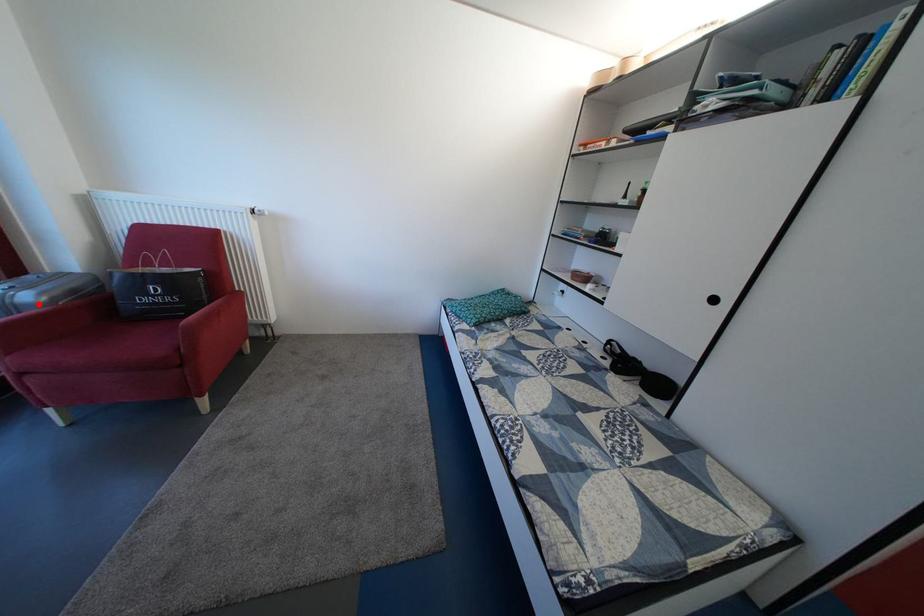
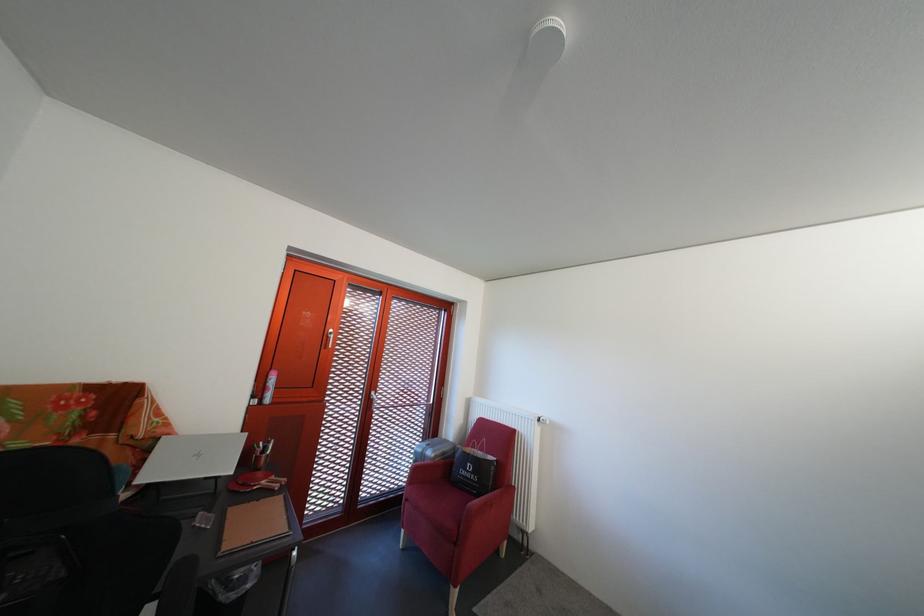
Question: A red point is marked in image1. In image2, is the corresponding 3D point closer to the camera or farther? Reply with the corresponding letter.

Choices:
 (A) The corresponding 3D point is closer.
 (B) The corresponding 3D point is farther.

Answer: (B)